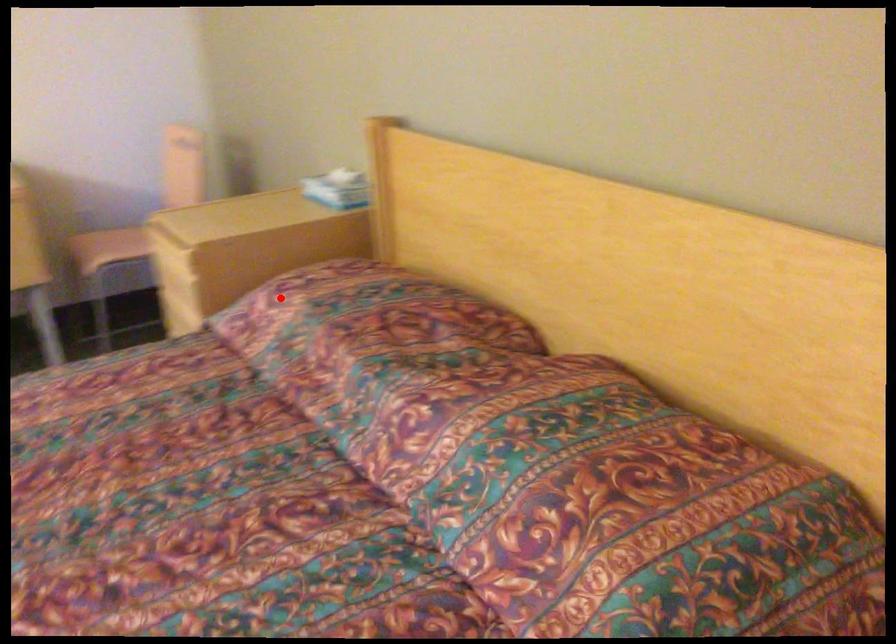
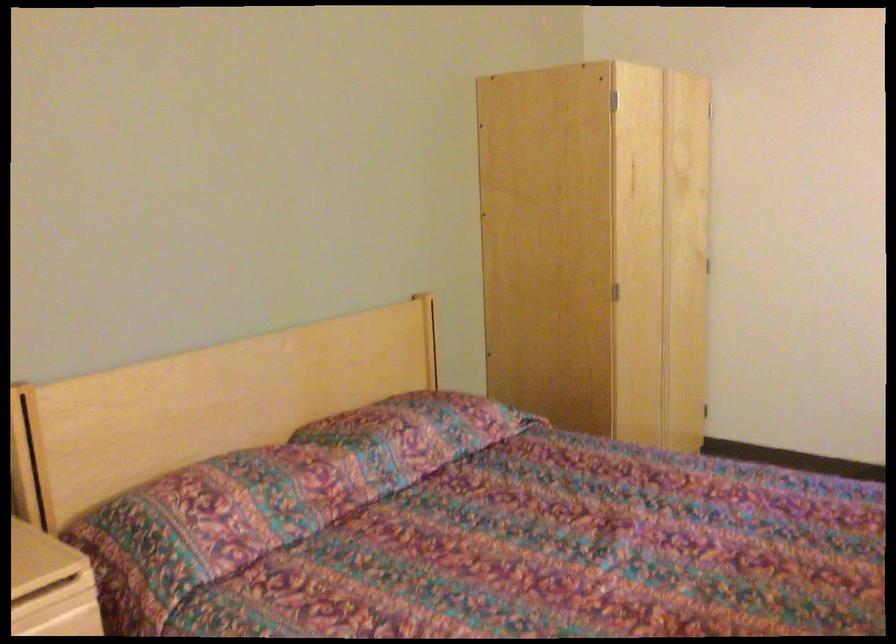
Question: I am providing you with two images of the same scene from different viewpoints. A red point is marked on the first image. Is the red point's position out of view in image 2?

Choices:
 (A) Yes
 (B) No

Answer: (B)